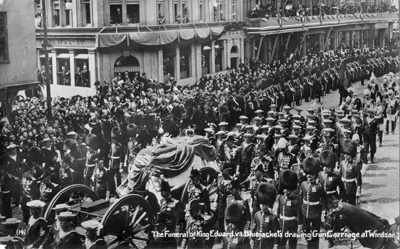
Find the location of `door`. door is located at coordinates (123, 73).